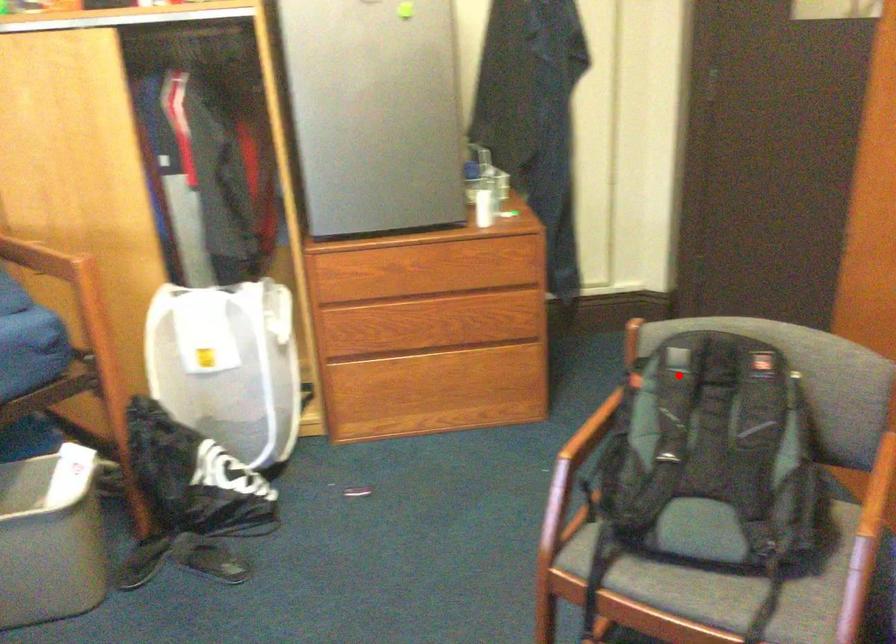
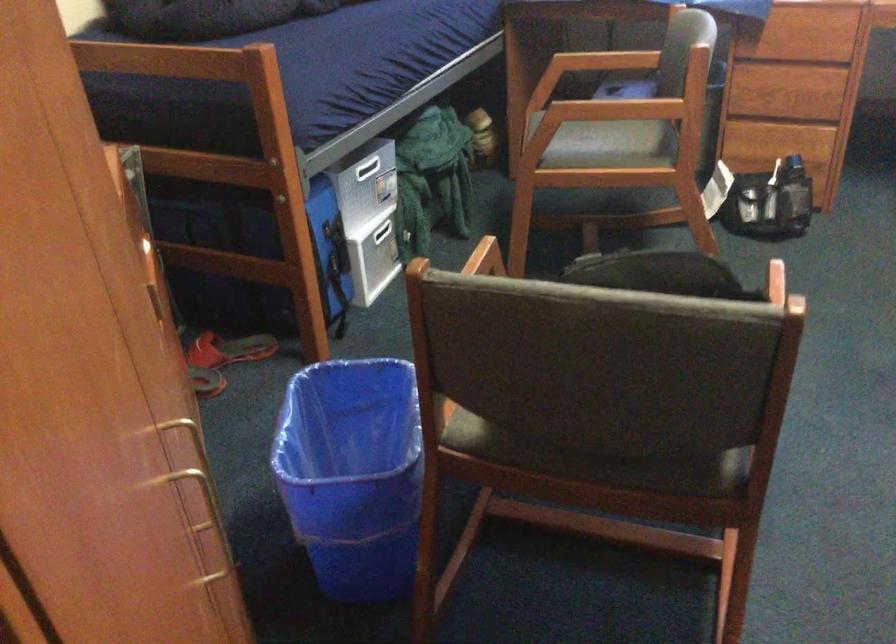
Question: A red point is marked in image1. In image2, is the corresponding 3D point closer to the camera or farther? Reply with the corresponding letter.

Choices:
 (A) The corresponding 3D point is closer.
 (B) The corresponding 3D point is farther.

Answer: (A)